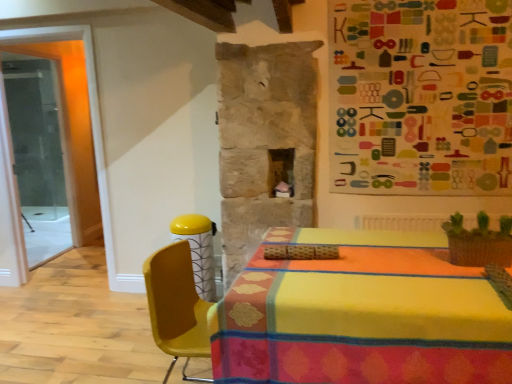
Measure the distance between point (172, 339) and camera.

Point (172, 339) and camera are 1.83 meters apart from each other.

What is the approximate height of transparent glass door at left?

The height of transparent glass door at left is 2.09 meters.

Find the location of a particular element. yellow plastic chair at center is located at coordinates (176, 306).

From a real-world perspective, which is physically below, yellow plastic chair at center or transparent glass door at left?

From a 3D spatial view, yellow plastic chair at center is below.

Is yellow plastic chair at center spatially inside transparent glass door at left, or outside of it?

yellow plastic chair at center is spatially situated outside transparent glass door at left.

Is yellow plastic chair at center next to transparent glass door at left?

No, yellow plastic chair at center is not touching transparent glass door at left.

Based on the photo, what's the angular difference between yellow plastic chair at center and transparent glass door at left's facing directions?

0.414 degrees.

Is multicolored fabric bulletin board at upper right positioned beyond the bounds of yellow plastic chair at center?

Indeed, multicolored fabric bulletin board at upper right is completely outside yellow plastic chair at center.

From a real-world perspective, which object rests below the other?

yellow plastic chair at center.

From the image's perspective, is multicolored fabric bulletin board at upper right over yellow plastic chair at center?

Yes.

Can you confirm if multicolored fabric bulletin board at upper right is shorter than yellow plastic chair at center?

No.

How different are the orientations of yellow plastic chair at center and multicolored fabric bulletin board at upper right in degrees?

The angular difference between yellow plastic chair at center and multicolored fabric bulletin board at upper right is 88.7 degrees.

Locate an element on the screen. This screenshot has width=512, height=384. bulletin board above the yellow plastic chair at center (from the image's perspective) is located at coordinates (421, 97).

Considering the positions of objects yellow plastic chair at center and multicolored fabric bulletin board at upper right in the image provided, who is more to the left, yellow plastic chair at center or multicolored fabric bulletin board at upper right?

Positioned to the left is yellow plastic chair at center.

How far apart are transparent glass door at left and multicolored fabric bulletin board at upper right?

A distance of 3.53 meters exists between transparent glass door at left and multicolored fabric bulletin board at upper right.

Is transparent glass door at left at the left side of multicolored fabric bulletin board at upper right?

Correct, you'll find transparent glass door at left to the left of multicolored fabric bulletin board at upper right.

Looking at this image, can you confirm if transparent glass door at left is wider than multicolored fabric bulletin board at upper right?

Correct, the width of transparent glass door at left exceeds that of multicolored fabric bulletin board at upper right.

From the image's perspective, is transparent glass door at left under yellow plastic chair at center?

No, from the image's perspective, transparent glass door at left is not below yellow plastic chair at center.

Which is more to the left, transparent glass door at left or yellow plastic chair at center?

transparent glass door at left.

Is transparent glass door at left not close to yellow plastic chair at center?

transparent glass door at left is positioned a significant distance from yellow plastic chair at center.

How many degrees apart are the facing directions of transparent glass door at left and yellow plastic chair at center?

The angular difference between transparent glass door at left and yellow plastic chair at center is 0.414 degrees.

The height and width of the screenshot is (384, 512). I want to click on bulletin board above the transparent glass door at left (from the image's perspective), so click(421, 97).

Considering the sizes of multicolored fabric bulletin board at upper right and transparent glass door at left in the image, is multicolored fabric bulletin board at upper right taller or shorter than transparent glass door at left?

Considering their sizes, multicolored fabric bulletin board at upper right has less height than transparent glass door at left.

Is multicolored fabric bulletin board at upper right wider than transparent glass door at left?

No, multicolored fabric bulletin board at upper right is not wider than transparent glass door at left.

From the image's perspective, which is below, multicolored fabric bulletin board at upper right or transparent glass door at left?

transparent glass door at left is shown below in the image.

Locate an element on the screen. The image size is (512, 384). glass door lying behind the yellow plastic chair at center is located at coordinates (38, 155).

Locate an element on the screen. The height and width of the screenshot is (384, 512). chair below the multicolored fabric bulletin board at upper right (from the image's perspective) is located at coordinates (176, 306).

Considering their positions, is yellow plastic chair at center positioned closer to transparent glass door at left than multicolored fabric bulletin board at upper right?

The object closer to transparent glass door at left is yellow plastic chair at center.

From the picture: Looking at the image, which one is located closer to transparent glass door at left, multicolored fabric bulletin board at upper right or yellow plastic chair at center?

The object closer to transparent glass door at left is yellow plastic chair at center.

When comparing their distances from multicolored fabric bulletin board at upper right, does transparent glass door at left or yellow plastic chair at center seem closer?

yellow plastic chair at center is closer to multicolored fabric bulletin board at upper right.

Looking at the image, which one is located closer to multicolored fabric bulletin board at upper right, yellow plastic chair at center or transparent glass door at left?

yellow plastic chair at center lies closer to multicolored fabric bulletin board at upper right than the other object.

Looking at this image, considering their positions, is transparent glass door at left positioned closer to yellow plastic chair at center than multicolored fabric bulletin board at upper right?

Among the two, multicolored fabric bulletin board at upper right is located nearer to yellow plastic chair at center.

In the scene shown: Based on their spatial positions, is multicolored fabric bulletin board at upper right or transparent glass door at left closer to yellow plastic chair at center?

The object closer to yellow plastic chair at center is multicolored fabric bulletin board at upper right.

This screenshot has width=512, height=384. Find the location of `chair between transparent glass door at left and multicolored fabric bulletin board at upper right from left to right`. chair between transparent glass door at left and multicolored fabric bulletin board at upper right from left to right is located at coordinates (176, 306).